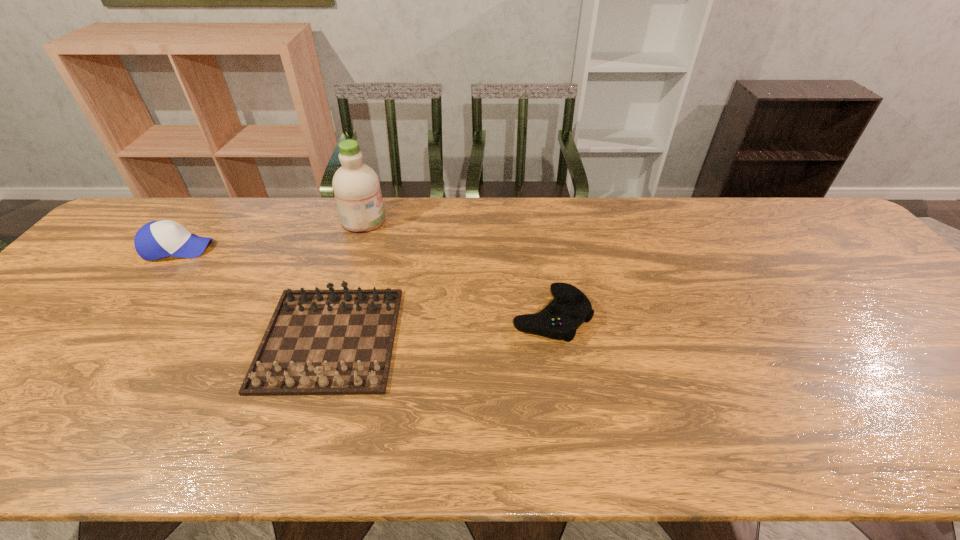
You are a GUI agent. You are given a task and a screenshot of the screen. Output one action in this format:
    pyautogui.click(x=<x>, y=<y>)
    Task: Click on the vacant area that lies between the rightmost object and the third shortest object
    The height and width of the screenshot is (540, 960).
    Given the screenshot: What is the action you would take?
    pyautogui.click(x=365, y=282)

Where is `free space between the control and the chessboard`? The height and width of the screenshot is (540, 960). free space between the control and the chessboard is located at coordinates (441, 327).

At what (x,y) coordinates should I click in order to perform the action: click on unoccupied area between the tallest object and the second farthest object. Please return your answer as a coordinate pair (x, y). The height and width of the screenshot is (540, 960). Looking at the image, I should click on (271, 234).

Find the location of a particular element. This screenshot has height=540, width=960. empty space that is in between the leftmost object and the control is located at coordinates (365, 282).

Locate an element on the screen. The height and width of the screenshot is (540, 960). free space that is in between the farthest object and the chessboard is located at coordinates (347, 280).

You are a GUI agent. You are given a task and a screenshot of the screen. Output one action in this format:
    pyautogui.click(x=<x>, y=<y>)
    Task: Click on the empty space that is in between the cleansing agent and the control
    The height and width of the screenshot is (540, 960).
    Given the screenshot: What is the action you would take?
    457,268

Find the location of a particular element. free space between the chessboard and the farthest object is located at coordinates (347, 280).

Locate an element on the screen. The width and height of the screenshot is (960, 540). vacant space that's between the cleansing agent and the third shortest object is located at coordinates (271, 234).

Identify the location of free space between the farthest object and the chessboard. This screenshot has width=960, height=540. (347, 280).

Select which object appears as the closest to the control. Please provide its 2D coordinates. Your answer should be formatted as a tuple, i.e. [(x, y)], where the tuple contains the x and y coordinates of a point satisfying the conditions above.

[(318, 342)]